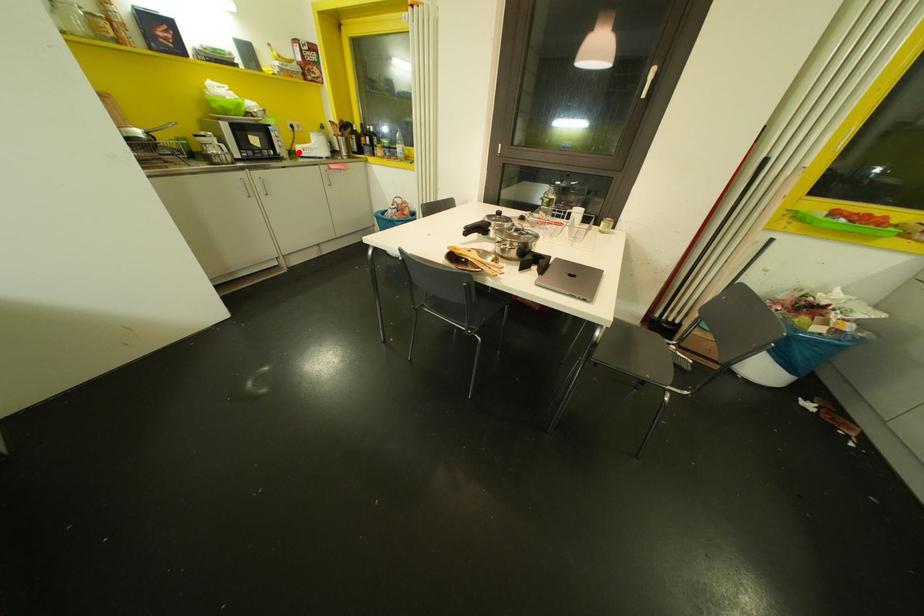
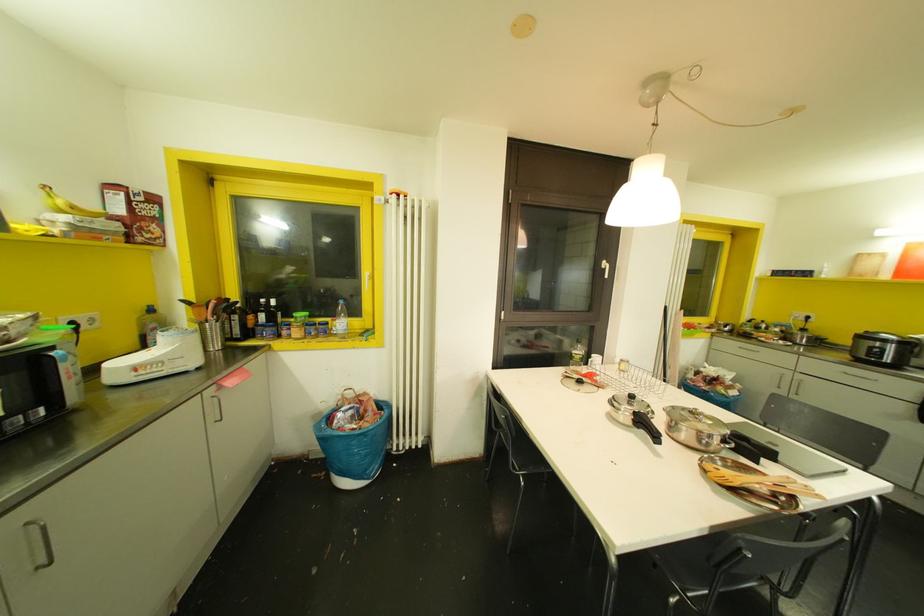
Question: I am providing you with two images of the same scene from different viewpoints. A red point is shown in image1. For the corresponding object point in image2, is it positioned nearer or farther from the camera?

Choices:
 (A) Nearer
 (B) Farther

Answer: (B)